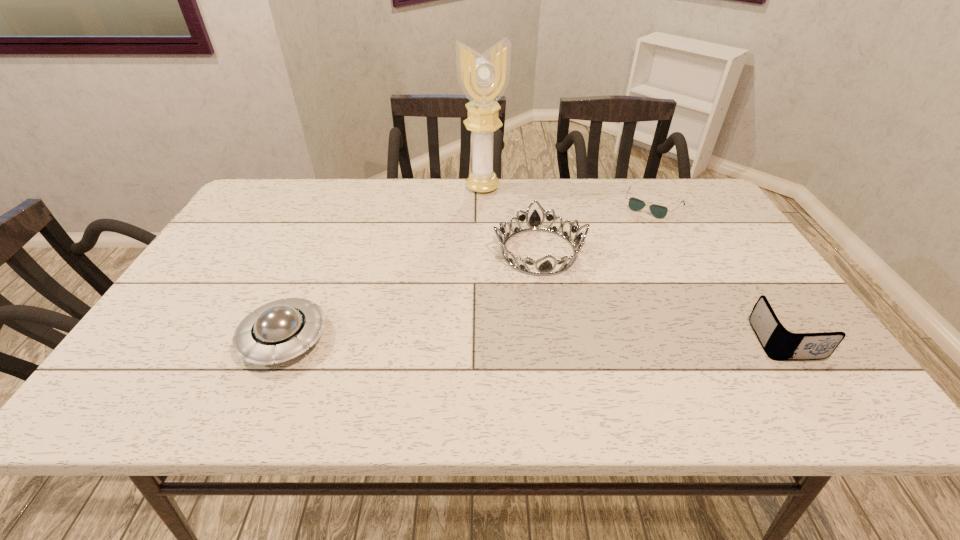
I want to click on sunglasses at the right edge, so click(x=658, y=211).

The height and width of the screenshot is (540, 960). Find the location of `object located in the far right corner section of the desktop`. object located in the far right corner section of the desktop is located at coordinates pyautogui.click(x=658, y=211).

Find the location of a particular element. This screenshot has width=960, height=540. object positioned at the near right corner is located at coordinates (779, 344).

In order to click on vacant region at the far edge of the desktop in this screenshot , I will do [x=334, y=212].

In order to click on free space at the near edge of the desktop in this screenshot , I will do `click(498, 368)`.

Locate an element on the screen. Image resolution: width=960 pixels, height=540 pixels. vacant space at the left edge is located at coordinates (220, 300).

You are a GUI agent. You are given a task and a screenshot of the screen. Output one action in this format:
    pyautogui.click(x=<x>, y=<y>)
    Task: Click on the free spot at the right edge of the desktop
    This screenshot has height=540, width=960.
    Given the screenshot: What is the action you would take?
    pyautogui.click(x=728, y=307)

At what (x,y) coordinates should I click in order to perform the action: click on free space at the far left corner of the desktop. Please return your answer as a coordinate pair (x, y). This screenshot has width=960, height=540. Looking at the image, I should click on (246, 213).

The height and width of the screenshot is (540, 960). Identify the location of vacant space at the far right corner. (699, 210).

Locate an element on the screen. The width and height of the screenshot is (960, 540). vacant area at the near right corner is located at coordinates point(806,361).